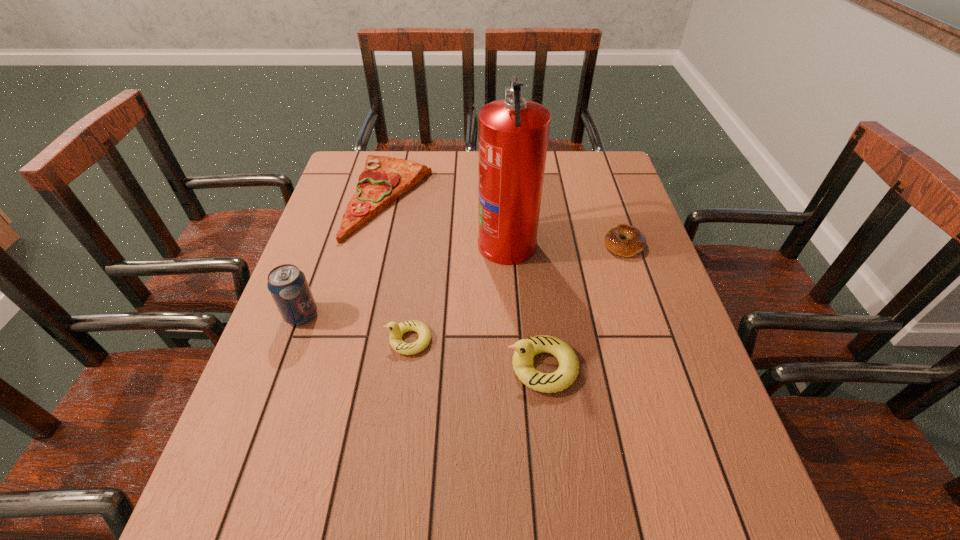
Find the location of a particular element. This screenshot has width=960, height=540. free space located 0.050m on the face of the third shortest object is located at coordinates (364, 340).

The height and width of the screenshot is (540, 960). Find the location of `vacant space located on the face of the taller duckling`. vacant space located on the face of the taller duckling is located at coordinates (325, 367).

Locate an element on the screen. The image size is (960, 540). vacant position located on the face of the taller duckling is located at coordinates (316, 367).

At what (x,y) coordinates should I click in order to perform the action: click on free region located on the face of the taller duckling. Please return your answer as a coordinate pair (x, y). Image resolution: width=960 pixels, height=540 pixels. Looking at the image, I should click on (330, 367).

I want to click on free spot located on the front of the pizza, so click(x=372, y=279).

Where is `free spot located 0.070m on the instruction side of the fire extinguisher`? The height and width of the screenshot is (540, 960). free spot located 0.070m on the instruction side of the fire extinguisher is located at coordinates (452, 242).

This screenshot has height=540, width=960. Find the location of `vacant space located on the instruction side of the fire extinguisher`. vacant space located on the instruction side of the fire extinguisher is located at coordinates (353, 242).

The image size is (960, 540). What are the coordinates of `blank space located 0.200m on the instruction side of the fire extinguisher` in the screenshot? It's located at (404, 242).

You are a GUI agent. You are given a task and a screenshot of the screen. Output one action in this format:
    pyautogui.click(x=<x>, y=<y>)
    Task: Click on the vacant space located 0.060m on the back of the shortest object
    
    Given the screenshot: What is the action you would take?
    pyautogui.click(x=614, y=215)

You are a GUI agent. You are given a task and a screenshot of the screen. Output one action in this format:
    pyautogui.click(x=<x>, y=<y>)
    Task: Click on the free region located 0.060m on the front of the pop soda
    
    Given the screenshot: What is the action you would take?
    pyautogui.click(x=289, y=351)